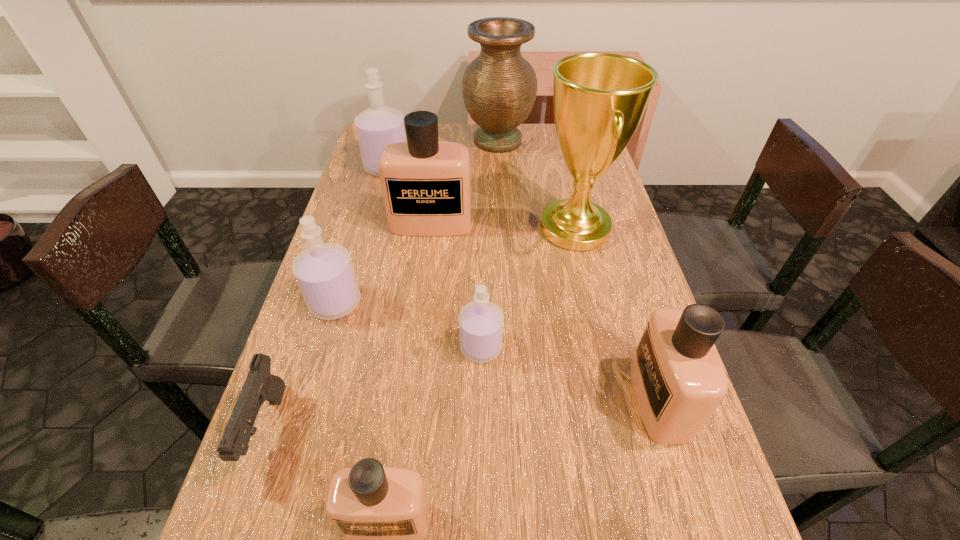
I want to click on the smallest purple perfume, so click(481, 322).

This screenshot has height=540, width=960. I want to click on the rightmost purple perfume, so click(481, 322).

Identify the location of the shortest object. The width and height of the screenshot is (960, 540). (260, 385).

You are a GUI agent. You are given a task and a screenshot of the screen. Output one action in this format:
    pyautogui.click(x=<x>, y=<y>)
    Task: Click on the vacant space located by the handles of the award
    The width and height of the screenshot is (960, 540).
    Given the screenshot: What is the action you would take?
    pyautogui.click(x=506, y=228)

Where is `free spot located by the handles of the award`? This screenshot has height=540, width=960. free spot located by the handles of the award is located at coordinates (393, 228).

Where is `vacant area situated by the handles of the award`? vacant area situated by the handles of the award is located at coordinates (461, 228).

Identify the location of free region located 0.180m on the front of the vase. This screenshot has height=540, width=960. (501, 192).

Locate an element on the screen. Image resolution: width=960 pixels, height=540 pixels. vacant area situated on the front label of the biggest beige perfume is located at coordinates (423, 291).

The image size is (960, 540). In order to click on vacant area situated on the front of the farthest perfume in this screenshot , I will do `click(367, 247)`.

Identify the location of vacant area situated on the front of the fourth nearest perfume. (279, 489).